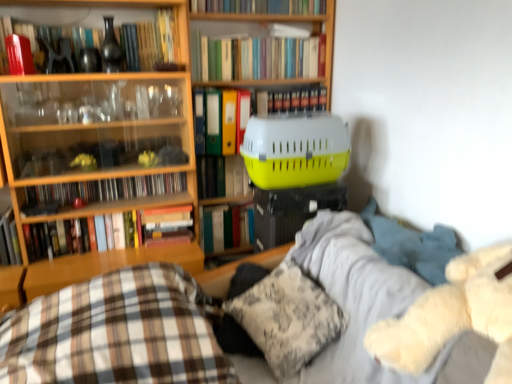
Question: Is wooden bookshelf at left closer to camera compared to hardcover book at center, arranged as the seventh book when ordered from the bottom?

Choices:
 (A) no
 (B) yes

Answer: (B)

Question: From a real-world perspective, is wooden bookshelf at left positioned over hardcover book at center, arranged as the seventh book when ordered from the bottom, based on gravity?

Choices:
 (A) no
 (B) yes

Answer: (A)

Question: Is wooden bookshelf at left smaller than hardcover book at center, arranged as the seventh book when ordered from the bottom?

Choices:
 (A) no
 (B) yes

Answer: (A)

Question: Is wooden bookshelf at left shorter than hardcover book at center, which is counted as the 5th book, starting from the top?

Choices:
 (A) yes
 (B) no

Answer: (B)

Question: Is the position of wooden bookshelf at left more distant than that of hardcover book at center, which is counted as the 5th book, starting from the top?

Choices:
 (A) no
 (B) yes

Answer: (A)

Question: Is point (203, 178) positioned closer to the camera than point (251, 52)?

Choices:
 (A) farther
 (B) closer

Answer: (A)

Question: Would you say hardcover book at center, which appears as the 5th book when ordered from the bottom, is inside or outside hardcover books at upper center, placed as the ninth book when sorted from bottom to top?

Choices:
 (A) outside
 (B) inside

Answer: (A)

Question: From the image's perspective, is hardcover book at center, the seventh book positioned from the top, above or below hardcover books at upper center, placed as the ninth book when sorted from bottom to top?

Choices:
 (A) below
 (B) above

Answer: (A)

Question: From a real-world perspective, is hardcover book at center, the seventh book positioned from the top, positioned above or below hardcover books at upper center, placed as the ninth book when sorted from bottom to top?

Choices:
 (A) below
 (B) above

Answer: (A)

Question: Is matte black vase at upper left, which is counted as the eighth book, starting from the bottom, taller or shorter than hardcover book at center, which appears as the 5th book when ordered from the bottom?

Choices:
 (A) short
 (B) tall

Answer: (A)

Question: In the image, is matte black vase at upper left, the fourth book positioned from the top, on the left side or the right side of hardcover book at center, which appears as the 5th book when ordered from the bottom?

Choices:
 (A) right
 (B) left

Answer: (B)

Question: Based on their sizes in the image, would you say matte black vase at upper left, which is counted as the eighth book, starting from the bottom, is bigger or smaller than hardcover book at center, the seventh book positioned from the top?

Choices:
 (A) small
 (B) big

Answer: (B)

Question: Is point (144, 26) positioned closer to the camera than point (212, 192)?

Choices:
 (A) closer
 (B) farther

Answer: (A)

Question: From the image's perspective, relative to matte black vase at upper left, which is counted as the eighth book, starting from the bottom, is yellow plastic pet carrier at upper right above or below?

Choices:
 (A) below
 (B) above

Answer: (A)

Question: Is yellow plastic pet carrier at upper right to the left or to the right of matte black vase at upper left, which is counted as the eighth book, starting from the bottom, in the image?

Choices:
 (A) right
 (B) left

Answer: (A)